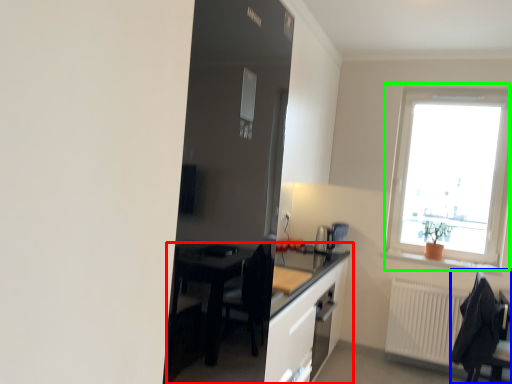
Question: Which object is positioned closest to table (highlighted by a red box)? Select from chair (highlighted by a blue box) and window (highlighted by a green box).

Choices:
 (A) chair
 (B) window

Answer: (A)